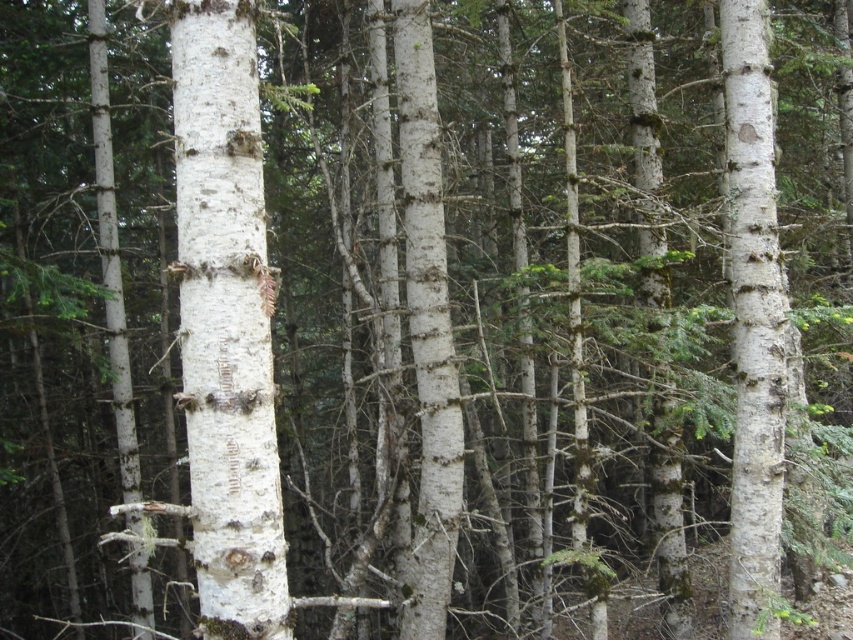
You are standing in the forest and want to find the white bark tree trunk at center. Based on the coordinates provided, where should you look relative to your current position?

The white bark tree trunk at center is located at coordinates point (225,323), which means it is positioned slightly to the right and lower center of your field of view.